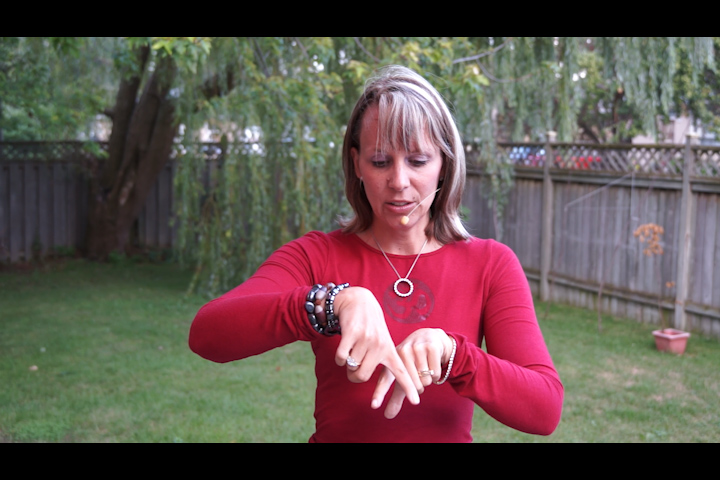
Locate an element on the screen. plant is located at coordinates (666, 230).